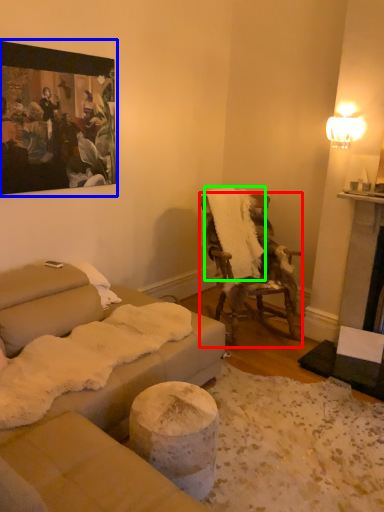
Question: Which object is the closest to the chair (highlighted by a red box)? Choose among these: picture frame (highlighted by a blue box) or blanket (highlighted by a green box).

Choices:
 (A) picture frame
 (B) blanket

Answer: (B)